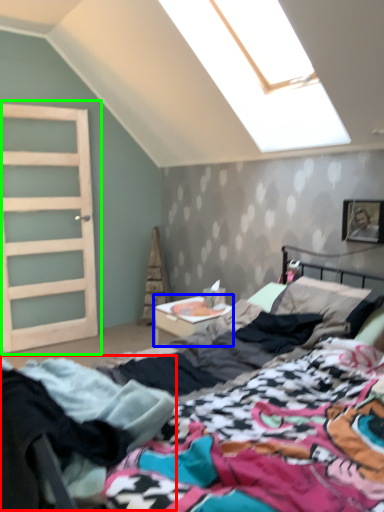
Question: Considering the real-world distances, which object is closest to clothing (highlighted by a red box)? nightstand (highlighted by a blue box) or door (highlighted by a green box).

Choices:
 (A) nightstand
 (B) door

Answer: (A)